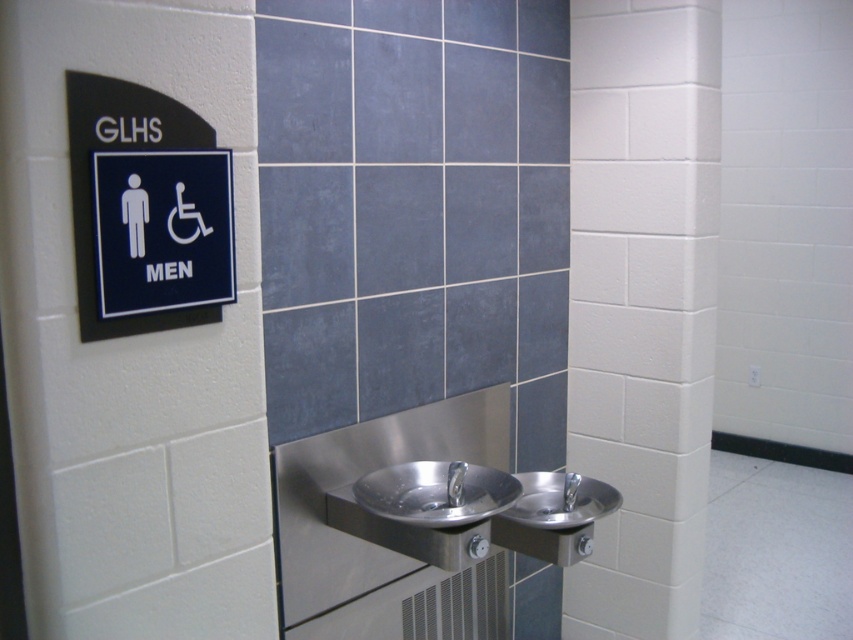
You are a maintenance worker needing to clean the stainless steel sink at center. You have a mop that can reach 4 feet. Is the camera within reach of your mop?

The stainless steel sink at center and camera are 4.42 feet apart from each other. Since the mop can only reach 4 feet, the camera is out of reach.

You are designing a layout for a restroom and need to ensure that the black plastic sign at upper left and the polished stainless steel sink at center are placed in a way that allows for easy access to both. Given their sizes, which object should be placed closer to the entrance to avoid blocking pathways?

The black plastic sign at upper left should be placed closer to the entrance since it occupies less space than the polished stainless steel sink at center, making it easier to position without obstructing pathways.